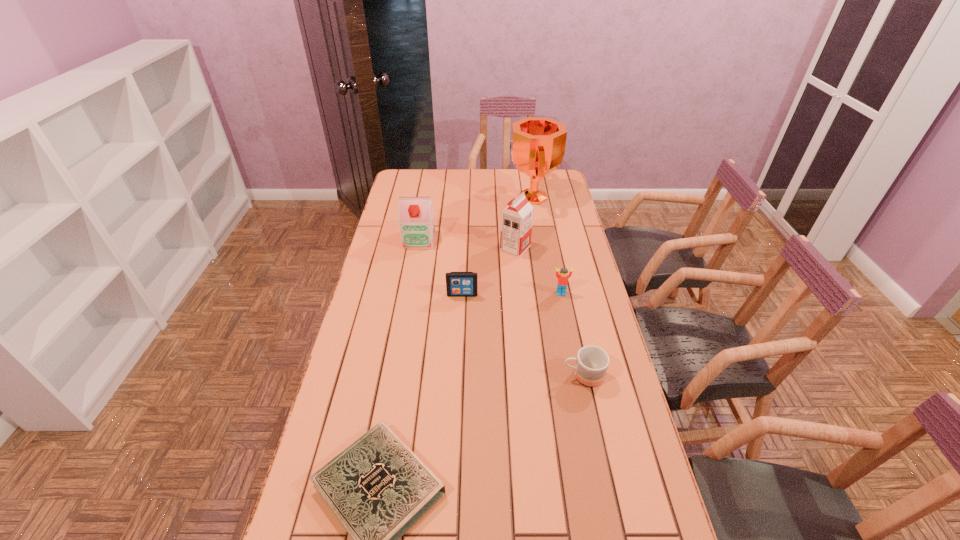
The width and height of the screenshot is (960, 540). I want to click on vacant area between the award and the iPod, so click(497, 246).

Identify which object is the nearest to the farthest object. Please provide its 2D coordinates. Your answer should be formatted as a tuple, i.e. [(x, y)], where the tuple contains the x and y coordinates of a point satisfying the conditions above.

[(516, 219)]

Image resolution: width=960 pixels, height=540 pixels. Identify the location of object that is the nearest to the tallest object. (516, 219).

I want to click on free space that satisfies the following two spatial constraints: 1. with the cap open on the fifth shortest object; 2. on the left side of the taller soya milk, so click(418, 248).